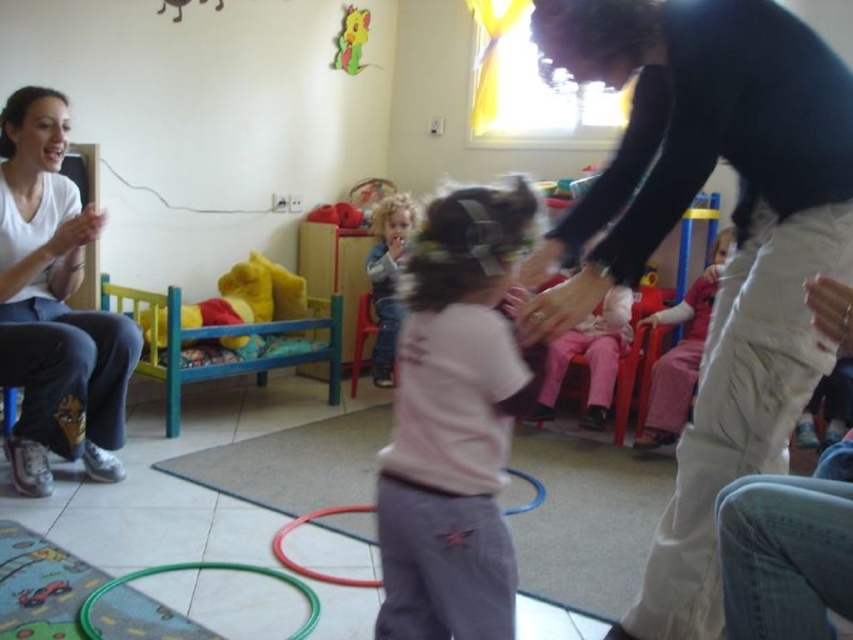
Question: Can you confirm if denim jeans at center is smaller than green plastic hoop at lower center?

Choices:
 (A) yes
 (B) no

Answer: (B)

Question: Estimate the real-world distances between objects in this image. Which object is closer to the white cotton shirt at left?

Choices:
 (A) green plastic hoop at lower center
 (B) denim jeans at center
 (C) rubber hula hoop at center

Answer: (A)

Question: Which of the following is the farthest from the observer?

Choices:
 (A) (374, 272)
 (B) (308, 573)

Answer: (A)

Question: Does green plastic hoop at lower center appear on the left side of rubber hula hoop at center?

Choices:
 (A) yes
 (B) no

Answer: (A)

Question: Considering the real-world distances, which object is closest to the white cotton shirt at left?

Choices:
 (A) green plastic hoop at lower center
 (B) denim jeans at center

Answer: (A)

Question: Does pink cotton shirt at center have a greater width compared to denim jeans at center?

Choices:
 (A) no
 (B) yes

Answer: (B)